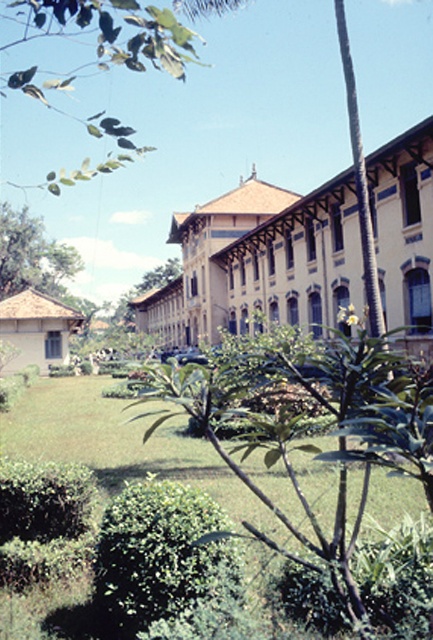
Question: Can you confirm if beige/wooden palace at center is wider than green grass at lower center?

Choices:
 (A) no
 (B) yes

Answer: (B)

Question: Can you confirm if beige/wooden palace at center is thinner than green grass at lower center?

Choices:
 (A) no
 (B) yes

Answer: (A)

Question: Which of the following is the farthest from the observer?

Choices:
 (A) green grass at lower center
 (B) beige/wooden palace at center

Answer: (B)

Question: Which point appears closest to the camera in this image?

Choices:
 (A) (235, 512)
 (B) (180, 288)

Answer: (A)

Question: Is beige/wooden palace at center positioned in front of green grass at lower center?

Choices:
 (A) yes
 (B) no

Answer: (B)